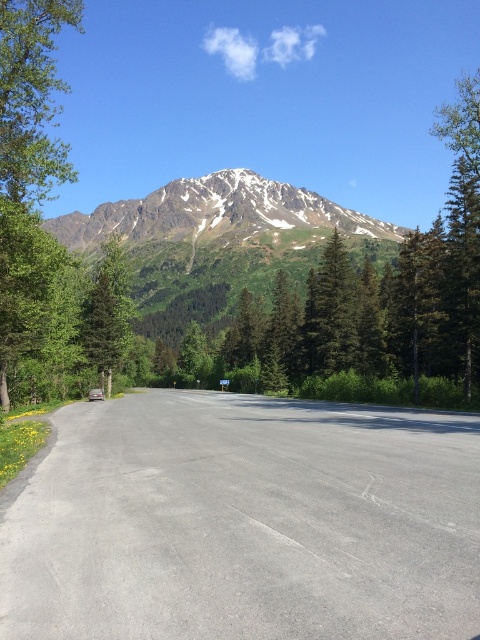
Question: Does gray asphalt road at center lie behind snowy granite mountain at upper center?

Choices:
 (A) yes
 (B) no

Answer: (B)

Question: Can you confirm if snowy granite mountain at upper center is bigger than green matte tree at left?

Choices:
 (A) no
 (B) yes

Answer: (B)

Question: Which is nearer to the green textured tree at center?

Choices:
 (A) green matte tree at left
 (B) snowy granite mountain at upper center
 (C) gray asphalt road at center

Answer: (A)

Question: Does gray asphalt road at center have a larger size compared to green textured tree at center?

Choices:
 (A) no
 (B) yes

Answer: (A)

Question: Which point is farther from the camera taking this photo?

Choices:
 (A) (268, 477)
 (B) (343, 288)

Answer: (B)

Question: Among these objects, which one is nearest to the camera?

Choices:
 (A) snowy granite mountain at upper center
 (B) green textured tree at center
 (C) green matte tree at left
 (D) gray asphalt road at center

Answer: (D)